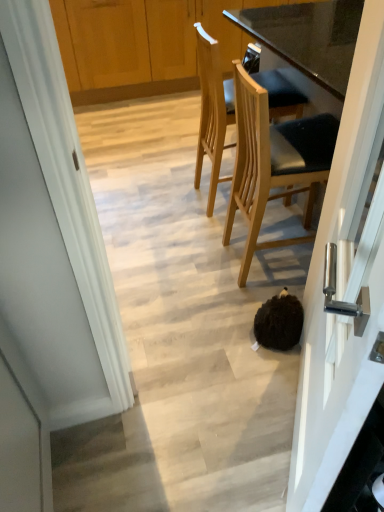
How much space does light wood/texture chair at upper center, which is the 2th chair from front to back, occupy vertically?

light wood/texture chair at upper center, which is the 2th chair from front to back, is 36.29 inches tall.

Identify the location of light wood/texture chair at upper center, which is the 2th chair from front to back. (212, 111).

Describe the element at coordinates (279, 322) in the screenshot. I see `brown fuzzy ball at lower center` at that location.

This screenshot has height=512, width=384. What do you see at coordinates (120, 49) in the screenshot? I see `wooden cabinets at upper center` at bounding box center [120, 49].

This screenshot has height=512, width=384. Identify the location of light brown wood chair at center, marked as the first chair in a front-to-back arrangement. (274, 163).

Find the location of `the 1st chair above the wooden cabinets at upper center (from a real-world perspective)`. the 1st chair above the wooden cabinets at upper center (from a real-world perspective) is located at coordinates click(x=212, y=111).

Is wooden cabinets at upper center in front of or behind light wood/texture chair at upper center, arranged as the first chair when viewed from the back, in the image?

wooden cabinets at upper center is positioned farther from the viewer than light wood/texture chair at upper center, arranged as the first chair when viewed from the back.

Can you confirm if brown fuzzy ball at lower center is positioned to the left of light brown wood chair at center, marked as the first chair in a front-to-back arrangement?

Correct, you'll find brown fuzzy ball at lower center to the left of light brown wood chair at center, marked as the first chair in a front-to-back arrangement.

Between brown fuzzy ball at lower center and light brown wood chair at center, which ranks as the 2th chair in back-to-front order, which one has smaller size?

Smaller between the two is brown fuzzy ball at lower center.

Can you confirm if brown fuzzy ball at lower center is thinner than light brown wood chair at center, which ranks as the 2th chair in back-to-front order?

Yes.

Is brown fuzzy ball at lower center positioned beyond the bounds of light brown wood chair at center, marked as the first chair in a front-to-back arrangement?

Yes, brown fuzzy ball at lower center is located beyond the bounds of light brown wood chair at center, marked as the first chair in a front-to-back arrangement.

Which of these two, light brown wood chair at center, which ranks as the 2th chair in back-to-front order, or white glossy door handle at center right, is smaller?

With smaller size is white glossy door handle at center right.

How many degrees apart are the facing directions of light brown wood chair at center, marked as the first chair in a front-to-back arrangement, and white glossy door handle at center right?

152 degrees.

Is white glossy door handle at center right at the back of light brown wood chair at center, marked as the first chair in a front-to-back arrangement?

light brown wood chair at center, marked as the first chair in a front-to-back arrangement, is not turned away from white glossy door handle at center right.

Does point (246, 73) come in front of point (288, 298)?

No, (246, 73) is behind (288, 298).

From the image's perspective, count 1st chairs upward from the brown fuzzy ball at lower center and point to it. Please provide its 2D coordinates.

[(274, 163)]

Could you tell me if light brown wood chair at center, which ranks as the 2th chair in back-to-front order, is turned towards brown fuzzy ball at lower center?

No.

Is light brown wood chair at center, which ranks as the 2th chair in back-to-front order, taller or shorter than brown fuzzy ball at lower center?

light brown wood chair at center, which ranks as the 2th chair in back-to-front order, is taller than brown fuzzy ball at lower center.

From the image's perspective, which is above, wooden cabinets at upper center or light brown wood chair at center, marked as the first chair in a front-to-back arrangement?

wooden cabinets at upper center is shown above in the image.

Is wooden cabinets at upper center spatially inside light brown wood chair at center, which ranks as the 2th chair in back-to-front order, or outside of it?

wooden cabinets at upper center is not enclosed by light brown wood chair at center, which ranks as the 2th chair in back-to-front order.

Find the location of a particular element. chair that is the 2nd one above the wooden cabinets at upper center (from a real-world perspective) is located at coordinates (274, 163).

Does wooden cabinets at upper center appear on the right side of light brown wood chair at center, marked as the first chair in a front-to-back arrangement?

No.

Is white glossy door handle at center right beside light brown wood chair at center, which ranks as the 2th chair in back-to-front order?

white glossy door handle at center right is not next to light brown wood chair at center, which ranks as the 2th chair in back-to-front order, and they're not touching.

Which is closer to the camera, (383, 98) or (326, 153)?

Point (383, 98)

Is white glossy door handle at center right facing away from light brown wood chair at center, marked as the first chair in a front-to-back arrangement?

No, light brown wood chair at center, marked as the first chair in a front-to-back arrangement, is not at the back of white glossy door handle at center right.

Consider the image. Considering the relative sizes of light wood/texture chair at upper center, arranged as the first chair when viewed from the back, and wooden cabinets at upper center in the image provided, is light wood/texture chair at upper center, arranged as the first chair when viewed from the back, smaller than wooden cabinets at upper center?

Yes, light wood/texture chair at upper center, arranged as the first chair when viewed from the back, is smaller than wooden cabinets at upper center.

Could you tell me if light wood/texture chair at upper center, which is the 2th chair from front to back, is turned towards wooden cabinets at upper center?

No, light wood/texture chair at upper center, which is the 2th chair from front to back, is not oriented towards wooden cabinets at upper center.

I want to click on the 1st chair above the wooden cabinets at upper center (from a real-world perspective), so click(212, 111).

Locate an element on the screen. The height and width of the screenshot is (512, 384). cabinetry on the left of light wood/texture chair at upper center, arranged as the first chair when viewed from the back is located at coordinates (120, 49).

Where is `chair in front of the brown fuzzy ball at lower center`? The image size is (384, 512). chair in front of the brown fuzzy ball at lower center is located at coordinates (274, 163).

Looking at the image, which one is located further to brown fuzzy ball at lower center, light wood/texture chair at upper center, which is the 2th chair from front to back, or wooden cabinets at upper center?

wooden cabinets at upper center lies further to brown fuzzy ball at lower center than the other object.

Estimate the real-world distances between objects in this image. Which object is further from wooden cabinets at upper center, white glossy door handle at center right or brown fuzzy ball at lower center?

white glossy door handle at center right.

Which object lies further to the anchor point brown fuzzy ball at lower center, wooden cabinets at upper center or light brown wood chair at center, which ranks as the 2th chair in back-to-front order?

The object further to brown fuzzy ball at lower center is wooden cabinets at upper center.

Considering their positions, is light wood/texture chair at upper center, which is the 2th chair from front to back, positioned closer to light brown wood chair at center, marked as the first chair in a front-to-back arrangement, than white glossy door handle at center right?

Based on the image, light wood/texture chair at upper center, which is the 2th chair from front to back, appears to be nearer to light brown wood chair at center, marked as the first chair in a front-to-back arrangement.

Looking at the image, which one is located further to light brown wood chair at center, marked as the first chair in a front-to-back arrangement, wooden cabinets at upper center or brown fuzzy ball at lower center?

Based on the image, wooden cabinets at upper center appears to be further to light brown wood chair at center, marked as the first chair in a front-to-back arrangement.

From the image, which object appears to be farther from light wood/texture chair at upper center, arranged as the first chair when viewed from the back, wooden cabinets at upper center or light brown wood chair at center, which ranks as the 2th chair in back-to-front order?

Based on the image, wooden cabinets at upper center appears to be further to light wood/texture chair at upper center, arranged as the first chair when viewed from the back.

Based on their spatial positions, is wooden cabinets at upper center or light wood/texture chair at upper center, which is the 2th chair from front to back, further from light brown wood chair at center, marked as the first chair in a front-to-back arrangement?

wooden cabinets at upper center.

Based on their spatial positions, is brown fuzzy ball at lower center or wooden cabinets at upper center further from light wood/texture chair at upper center, which is the 2th chair from front to back?

wooden cabinets at upper center lies further to light wood/texture chair at upper center, which is the 2th chair from front to back, than the other object.

Where is `head between white glossy door handle at center right and wooden cabinets at upper center from front to back`? The image size is (384, 512). head between white glossy door handle at center right and wooden cabinets at upper center from front to back is located at coordinates (279, 322).

Find the location of `head located between white glossy door handle at center right and light wood/texture chair at upper center, arranged as the first chair when viewed from the back, in the depth direction`. head located between white glossy door handle at center right and light wood/texture chair at upper center, arranged as the first chair when viewed from the back, in the depth direction is located at coordinates (279, 322).

This screenshot has height=512, width=384. In order to click on chair between light brown wood chair at center, which ranks as the 2th chair in back-to-front order, and wooden cabinets at upper center from front to back in this screenshot , I will do `click(212, 111)`.

At what (x,y) coordinates should I click in order to perform the action: click on chair between white glossy door handle at center right and brown fuzzy ball at lower center in the front-back direction. Please return your answer as a coordinate pair (x, y). Looking at the image, I should click on (274, 163).